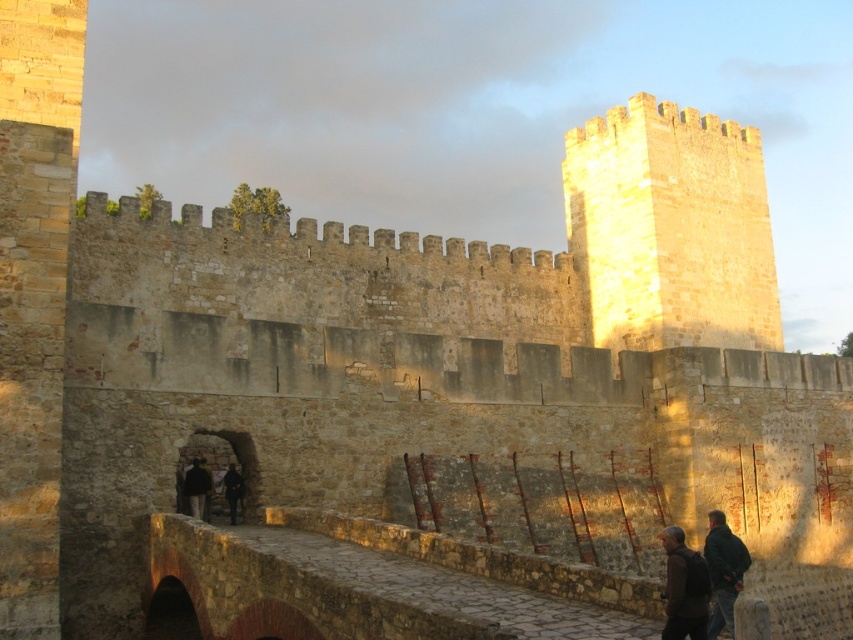
Question: Where is dark brown leather jacket at lower right located in relation to dark green jacket at lower right in the image?

Choices:
 (A) below
 (B) above

Answer: (B)

Question: Among these points, which one is nearest to the camera?

Choices:
 (A) (688, 557)
 (B) (195, 509)
 (C) (225, 497)

Answer: (A)

Question: Which is farther from the dark brown leather jacket at lower right?

Choices:
 (A) dark green jacket at lower right
 (B) dark brown leather jacket at center
 (C) black matte jacket at lower left

Answer: (C)

Question: Which object appears farthest from the camera in this image?

Choices:
 (A) dark green jacket at lower right
 (B) dark brown leather jacket at lower right

Answer: (A)

Question: Is dark green jacket at lower right positioned at the back of dark brown leather jacket at center?

Choices:
 (A) no
 (B) yes

Answer: (A)

Question: Is dark green jacket at lower right further to the viewer compared to dark brown leather jacket at center?

Choices:
 (A) yes
 (B) no

Answer: (B)